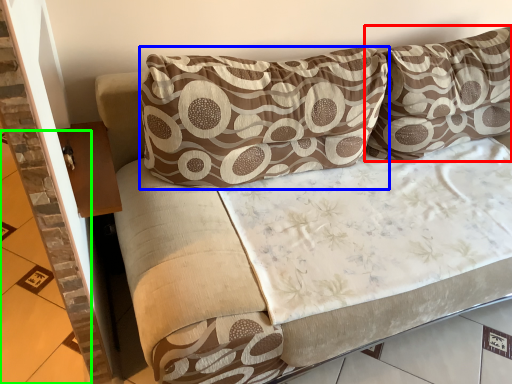
Question: Which is farther away from pillow (highlighted by a red box)? pillow (highlighted by a blue box) or tile (highlighted by a green box)?

Choices:
 (A) pillow
 (B) tile

Answer: (B)